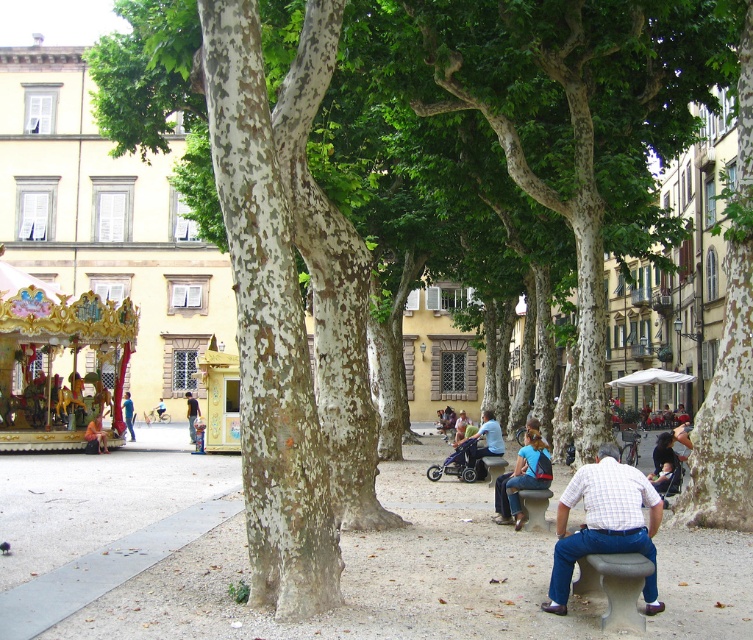
Who is positioned more to the right, gray concrete bench at lower right or dark blue jeans at lower right?

dark blue jeans at lower right is more to the right.

This screenshot has width=753, height=640. What are the coordinates of `gray concrete bench at lower right` in the screenshot? It's located at (614, 586).

Identify the location of gray concrete bench at lower right. (614, 586).

Can you confirm if light brown leather chair at lower right is thinner than light blue shirt at center?

No.

Which is in front, point (564, 500) or point (489, 417)?

Point (564, 500)

Locate an element on the screen. light brown leather chair at lower right is located at coordinates (605, 524).

This screenshot has height=640, width=753. What are the coordinates of `light brown leather chair at lower right` in the screenshot? It's located at (605, 524).

Who is positioned more to the right, light blue shirt at center or light blue jeans at center?

light blue shirt at center

Who is higher up, light blue shirt at center or light blue jeans at center?

light blue shirt at center is above.

Locate an element on the screen. The image size is (753, 640). light blue shirt at center is located at coordinates (485, 442).

Locate an element on the screen. light blue shirt at center is located at coordinates (485, 442).